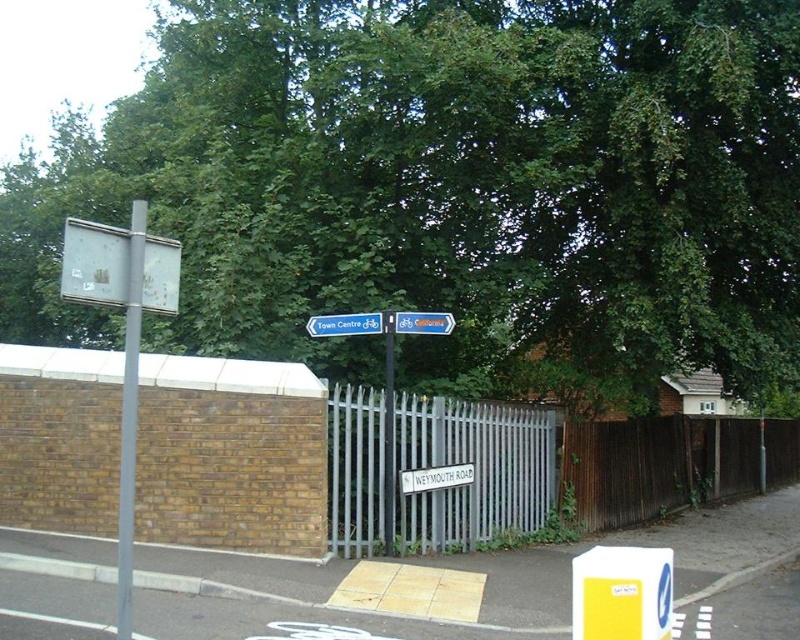
You are a cyclist approaching the street corner and need to reach the Town Centre. There is a green leafy tree at upper center. Based on the position of the tree, which direction should you turn to follow the signs towards the Town Centre?

The green leafy tree at upper center is located at point (x=449, y=188), so you should turn towards the direction indicated by the blue directional signs pointing to Town Centre, which are mounted on the metal pole near the tree.

You are standing at the street corner and want to determine which point is closer to you. The points are labeled as point 1 at coordinates (329,461) and point 2 at coordinates (176,259). Based on the scene, which point is closer to your current position?

Point 2 at coordinates (176,259) is closer to your current position because it is less further away than point 1 at coordinates (329,461).